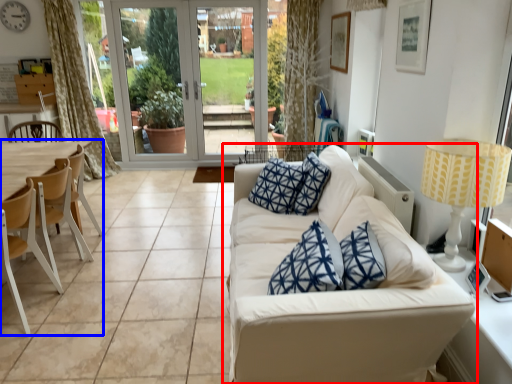
Question: Which object is closer to the camera taking this photo, studio couch (highlighted by a red box) or armchair (highlighted by a blue box)?

Choices:
 (A) studio couch
 (B) armchair

Answer: (A)